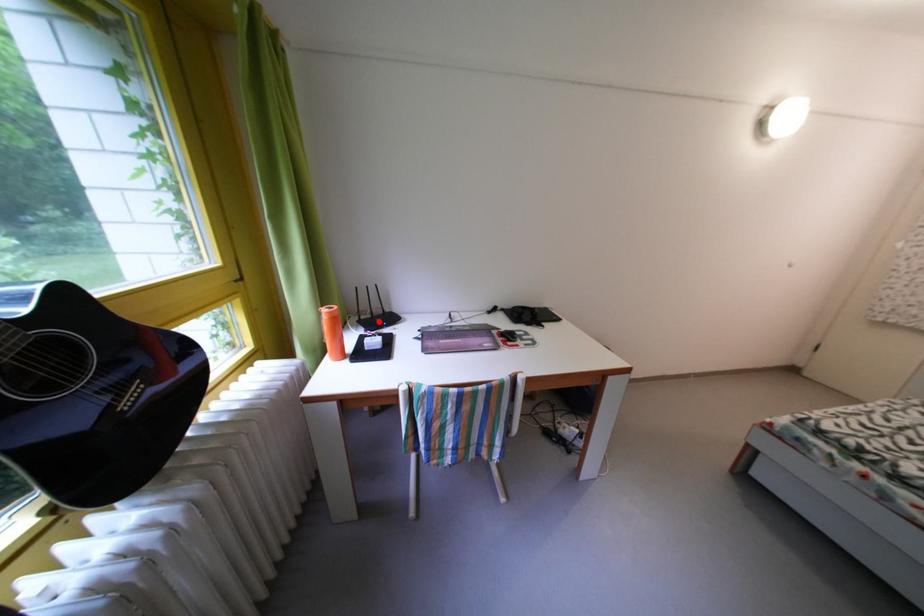
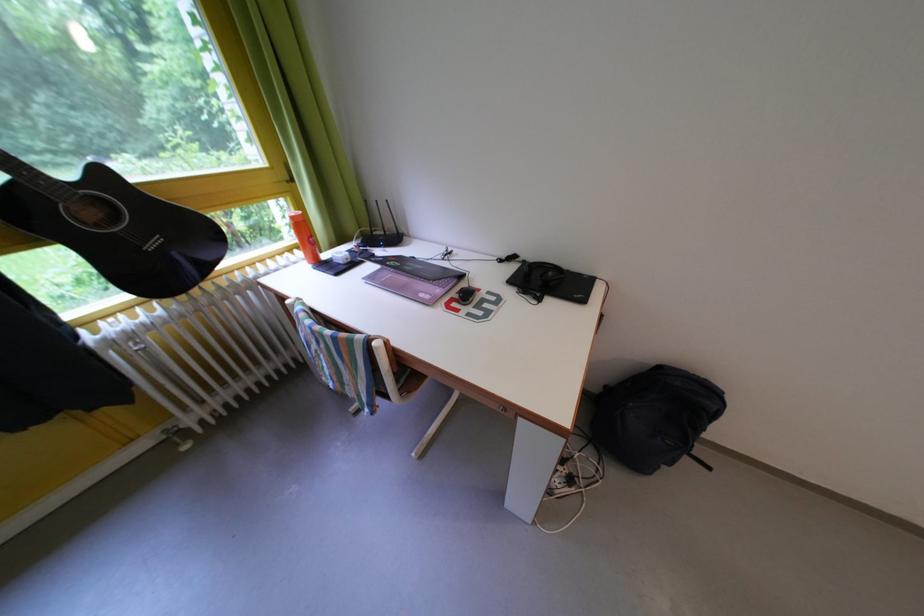
Find the pixel in the second image that matches the highlighted location in the first image.

(392, 238)